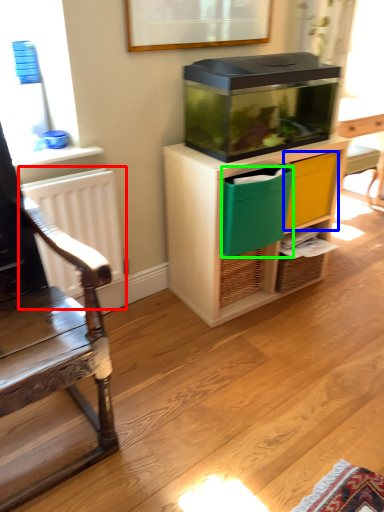
Question: Based on their relative distances, which object is nearer to radiator (highlighted by a red box)? Choose from drawer (highlighted by a blue box) and crate (highlighted by a green box).

Choices:
 (A) drawer
 (B) crate

Answer: (B)